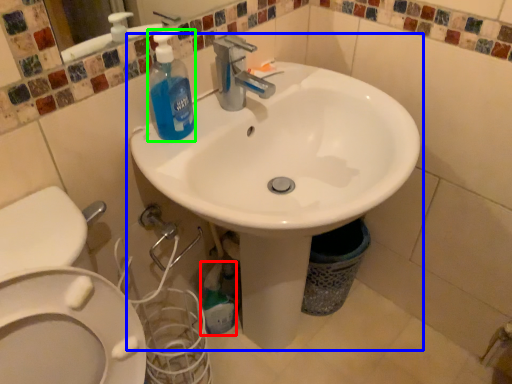
Question: Considering the real-world distances, which object is closest to cleaning product (highlighted by a red box)? sink (highlighted by a blue box) or cleaning product (highlighted by a green box).

Choices:
 (A) sink
 (B) cleaning product

Answer: (A)